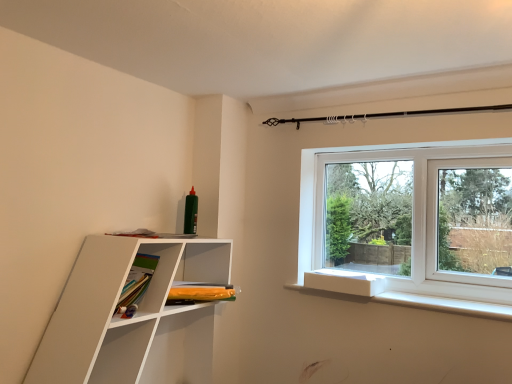
Question: Is white matte shelf at left shorter than orange matte bookshelf at lower left?

Choices:
 (A) yes
 (B) no

Answer: (B)

Question: Is white matte shelf at left at the right side of orange matte bookshelf at lower left?

Choices:
 (A) yes
 (B) no

Answer: (B)

Question: Is white matte shelf at left turned away from orange matte bookshelf at lower left?

Choices:
 (A) no
 (B) yes

Answer: (B)

Question: Is white matte shelf at left to the left of orange matte bookshelf at lower left from the viewer's perspective?

Choices:
 (A) no
 (B) yes

Answer: (B)

Question: Can you see white matte shelf at left touching orange matte bookshelf at lower left?

Choices:
 (A) yes
 (B) no

Answer: (B)

Question: Is orange matte bookshelf at lower left completely or partially inside white matte shelf at left?

Choices:
 (A) yes
 (B) no

Answer: (A)

Question: Can we say orange matte bookshelf at lower left lies outside white matte shelf at left?

Choices:
 (A) yes
 (B) no

Answer: (B)

Question: From the image's perspective, is orange matte bookshelf at lower left on top of white matte shelf at left?

Choices:
 (A) no
 (B) yes

Answer: (B)

Question: Considering the relative sizes of orange matte bookshelf at lower left and white matte shelf at left in the image provided, is orange matte bookshelf at lower left taller than white matte shelf at left?

Choices:
 (A) yes
 (B) no

Answer: (B)

Question: From the image's perspective, is orange matte bookshelf at lower left under white matte shelf at left?

Choices:
 (A) yes
 (B) no

Answer: (B)

Question: Considering the relative positions of orange matte bookshelf at lower left and white matte shelf at left in the image provided, is orange matte bookshelf at lower left to the left of white matte shelf at left from the viewer's perspective?

Choices:
 (A) no
 (B) yes

Answer: (A)

Question: Is orange matte bookshelf at lower left surrounding white matte shelf at left?

Choices:
 (A) yes
 (B) no

Answer: (B)

Question: In terms of height, does white matte shelf at left look taller or shorter compared to orange matte bookshelf at lower left?

Choices:
 (A) tall
 (B) short

Answer: (A)